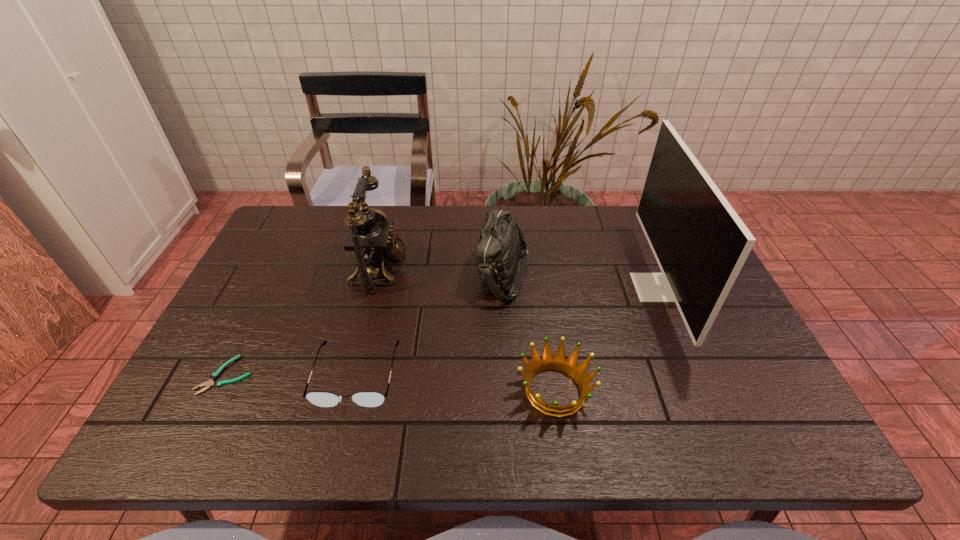
Where is `free space located 0.110m on the front-facing side of the tallest object`? This screenshot has height=540, width=960. free space located 0.110m on the front-facing side of the tallest object is located at coordinates (595, 287).

At what (x,y) coordinates should I click in order to perform the action: click on vacant space located on the rotary dial of the second tallest object. Please return your answer as a coordinate pair (x, y). The width and height of the screenshot is (960, 540). Looking at the image, I should click on (434, 269).

Find the location of a particular element. This screenshot has height=540, width=960. vacant region located at the front padded panel of the shoulder bag is located at coordinates (427, 275).

Where is `vacant space located 0.160m at the front padded panel of the shoulder bag`? The width and height of the screenshot is (960, 540). vacant space located 0.160m at the front padded panel of the shoulder bag is located at coordinates (420, 275).

I want to click on free space located at the front padded panel of the shoulder bag, so click(x=393, y=275).

Where is `free space located on the right of the crown`? Image resolution: width=960 pixels, height=540 pixels. free space located on the right of the crown is located at coordinates (617, 390).

You are a GUI agent. You are given a task and a screenshot of the screen. Output one action in this format:
    pyautogui.click(x=<x>, y=<y>)
    Task: Click on the vacant region located 0.070m on the lenses of the second shortest object
    The width and height of the screenshot is (960, 540).
    Given the screenshot: What is the action you would take?
    pyautogui.click(x=341, y=440)

You are a GUI agent. You are given a task and a screenshot of the screen. Output one action in this format:
    pyautogui.click(x=<x>, y=<y>)
    Task: Click on the vacant area situated on the right of the shortest object
    The image size is (960, 540).
    Given the screenshot: What is the action you would take?
    pyautogui.click(x=382, y=375)

You are a GUI agent. You are given a task and a screenshot of the screen. Output one action in this format:
    pyautogui.click(x=<x>, y=<y>)
    Task: Click on the monitor that is at the far edge
    The height and width of the screenshot is (540, 960).
    Given the screenshot: What is the action you would take?
    700,243

Where is `telephone present at the far edge`? The width and height of the screenshot is (960, 540). telephone present at the far edge is located at coordinates (370, 240).